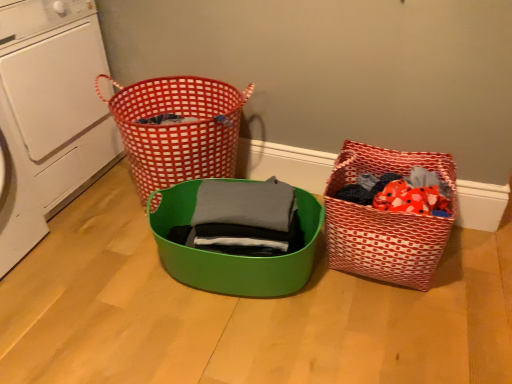
Where is `free spot to the right of red woven fabric basket at lower right, which appears as the first basket when viewed from the right`? Image resolution: width=512 pixels, height=384 pixels. free spot to the right of red woven fabric basket at lower right, which appears as the first basket when viewed from the right is located at coordinates [x=477, y=261].